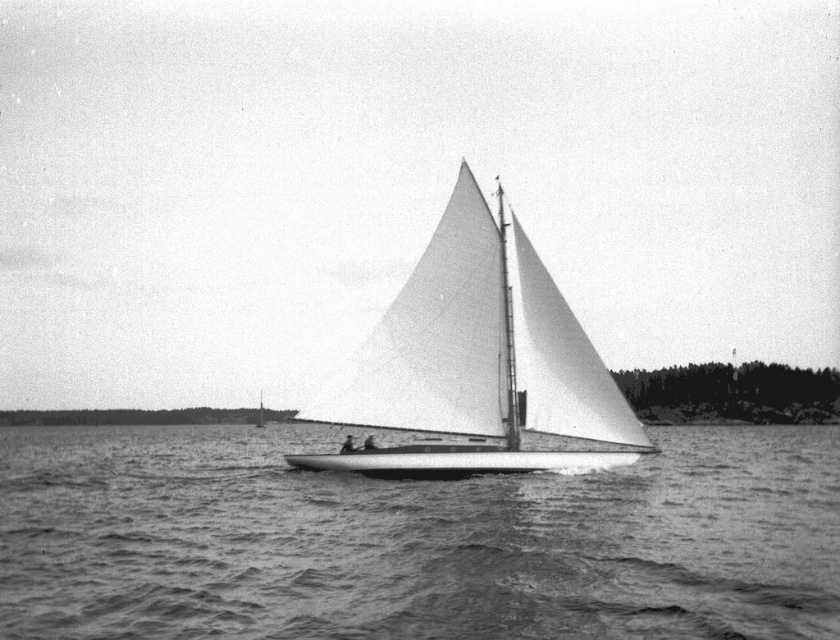
Question: Can you confirm if smooth water at center is positioned to the left of white matte sailboat at center?

Choices:
 (A) no
 (B) yes

Answer: (B)

Question: Is smooth water at center closer to the viewer compared to white matte sailboat at center?

Choices:
 (A) yes
 (B) no

Answer: (A)

Question: Which point is farther from the camera taking this photo?

Choices:
 (A) (516, 566)
 (B) (592, 451)

Answer: (B)

Question: Is smooth water at center above white matte sailboat at center?

Choices:
 (A) no
 (B) yes

Answer: (A)